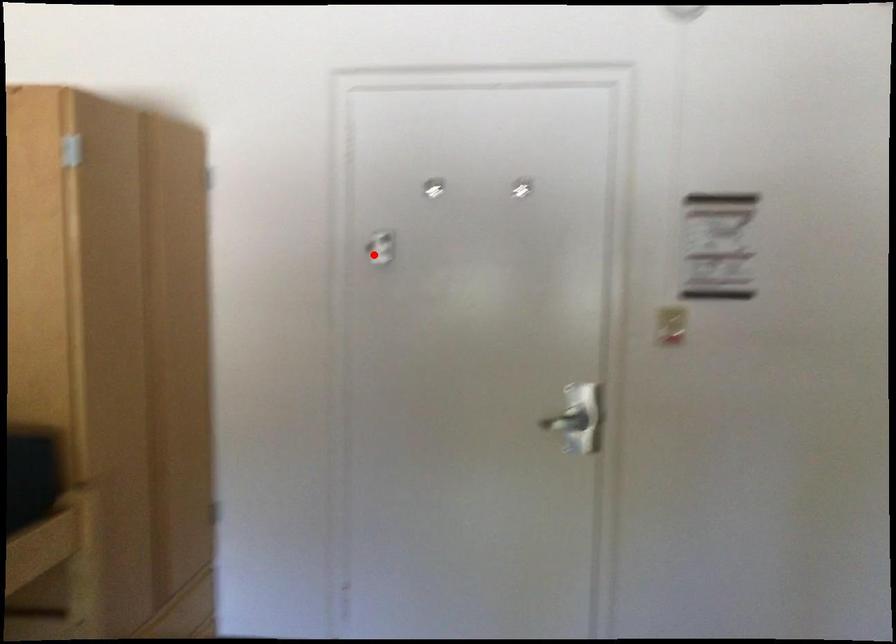
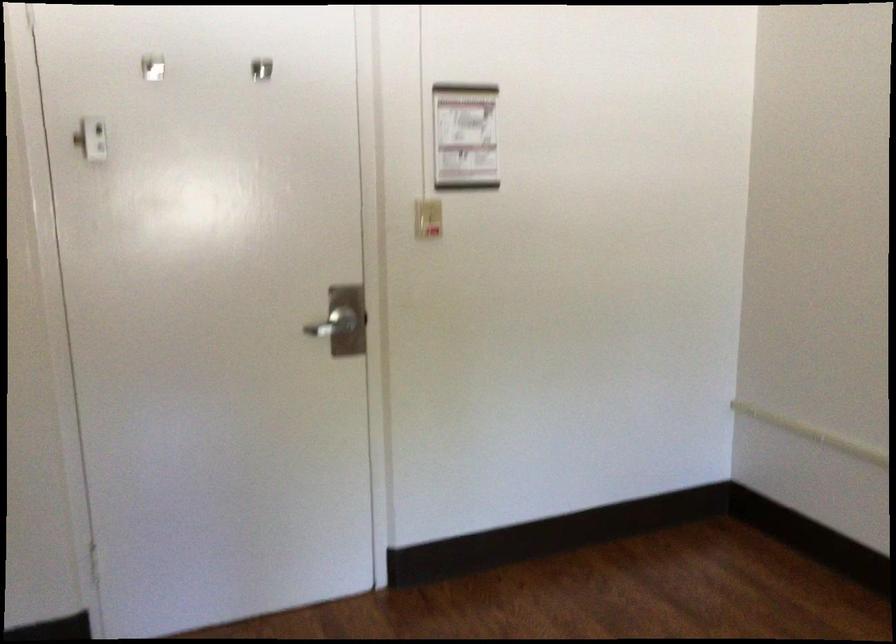
Locate, in the second image, the point that corresponds to the highlighted location in the first image.

(85, 149)